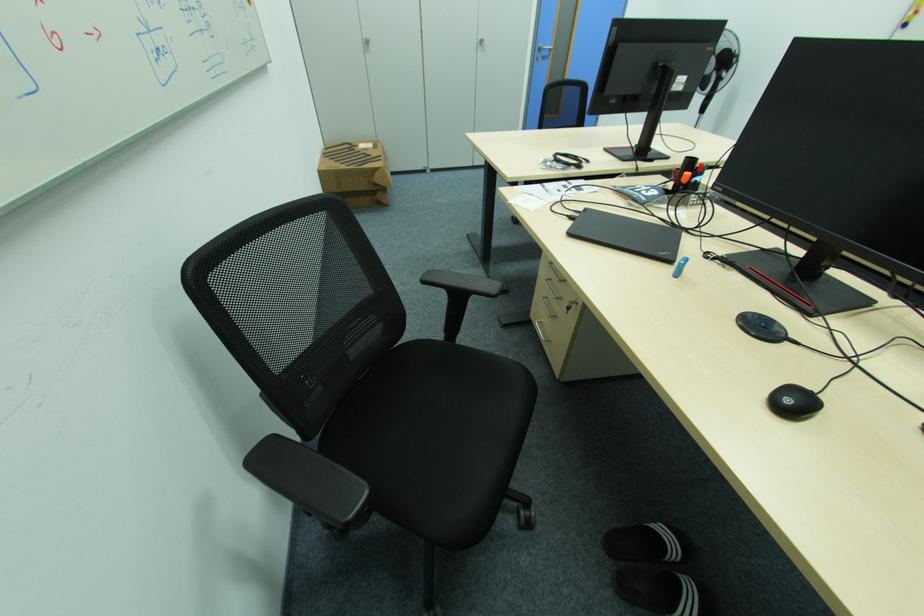
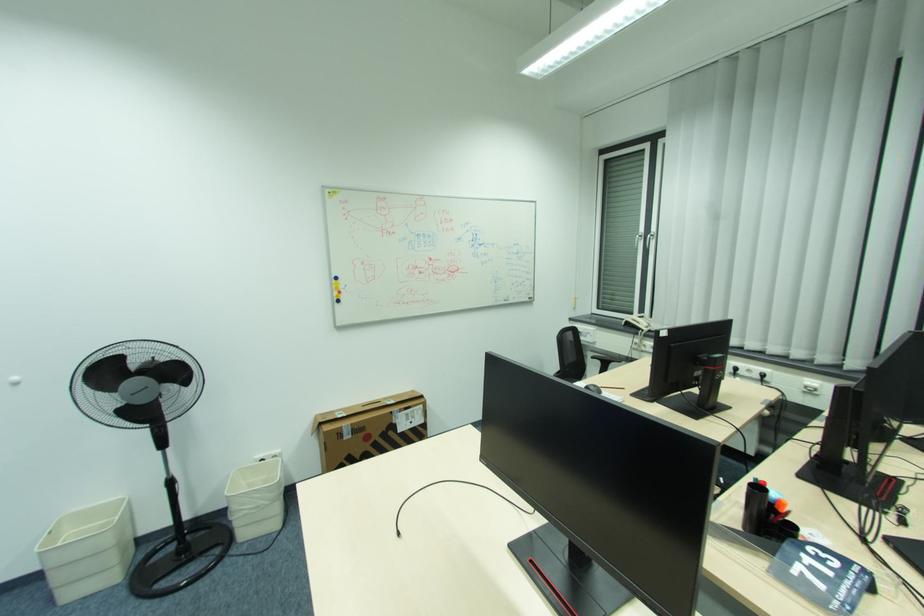
Where in the second image is the point corresponding to (x=817, y=306) from the first image?

(896, 480)